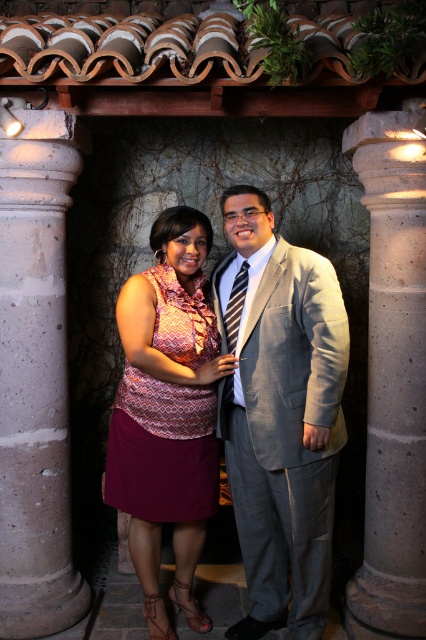
Question: In this image, where is concrete column at left located relative to striped fabric tie at center?

Choices:
 (A) right
 (B) left

Answer: (B)

Question: Based on their relative distances, which object is nearer to the gray concrete column at center?

Choices:
 (A) matte pink dress at center
 (B) concrete column at left
 (C) gray suit at center

Answer: (C)

Question: Does gray suit at center appear over matte pink dress at center?

Choices:
 (A) no
 (B) yes

Answer: (B)

Question: Which is farther from the concrete column at left?

Choices:
 (A) gray suit at center
 (B) gray concrete column at center
 (C) matte pink dress at center

Answer: (B)

Question: Which point is closer to the camera?

Choices:
 (A) 414,228
 (B) 54,493

Answer: (A)

Question: Does gray concrete column at center appear under striped fabric tie at center?

Choices:
 (A) yes
 (B) no

Answer: (A)